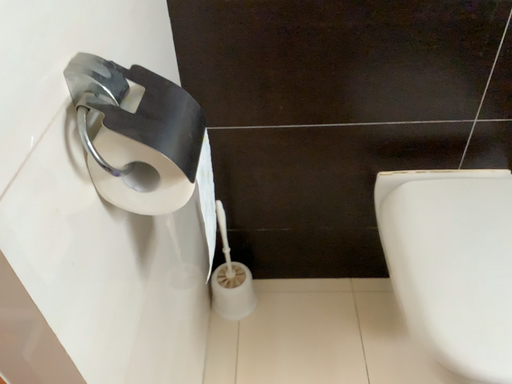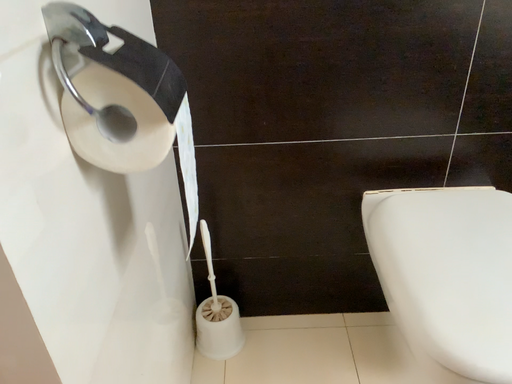
Question: Which way did the camera rotate in the video?

Choices:
 (A) rotated upward
 (B) rotated downward

Answer: (A)